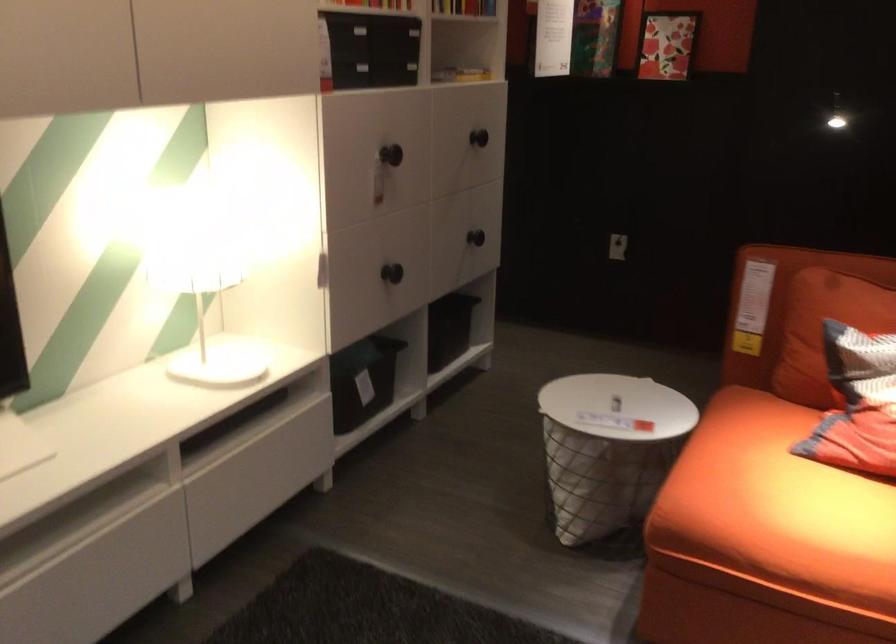
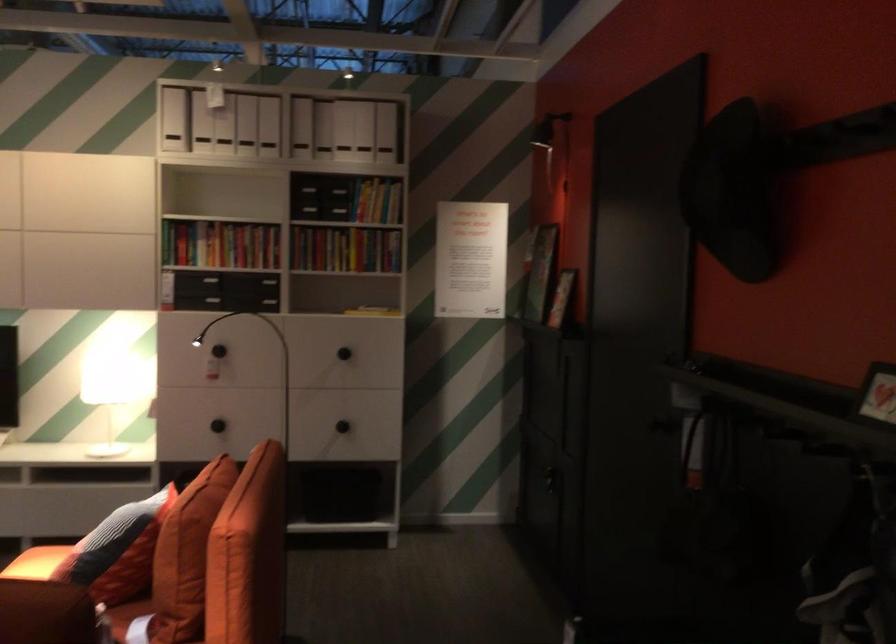
The point at (505, 227) is marked in the first image. Where is the corresponding point in the second image?

(341, 426)